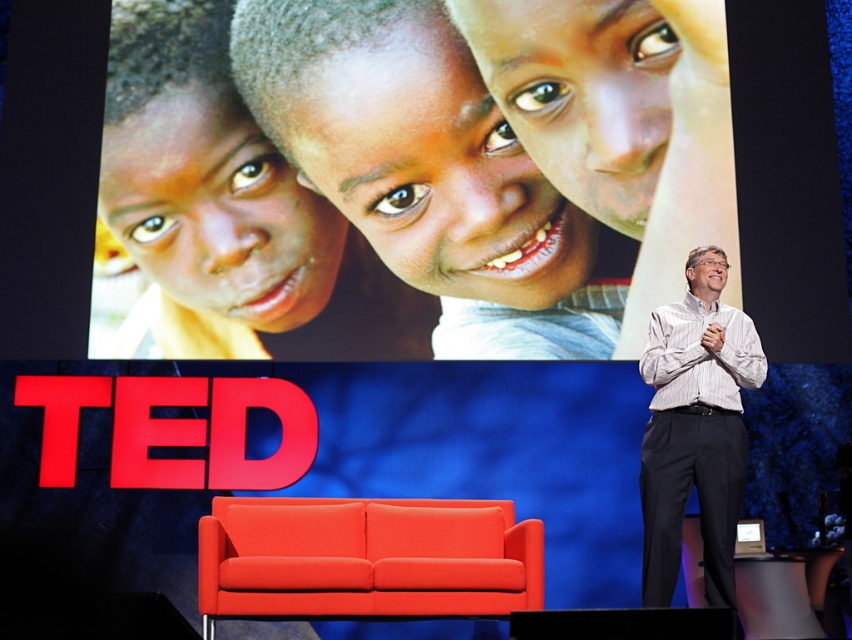
Question: Is matte orange couch at lower center wider than white striped shirt at right?

Choices:
 (A) yes
 (B) no

Answer: (A)

Question: Does matte orange couch at lower center have a larger size compared to white striped shirt at right?

Choices:
 (A) no
 (B) yes

Answer: (B)

Question: Where is matte orange couch at lower center located in relation to white striped shirt at right in the image?

Choices:
 (A) below
 (B) above

Answer: (A)

Question: Which object appears farthest from the camera in this image?

Choices:
 (A) white striped shirt at right
 (B) matte orange couch at lower center

Answer: (B)

Question: Which object appears farthest from the camera in this image?

Choices:
 (A) white striped shirt at right
 (B) matte orange couch at lower center

Answer: (B)

Question: Which point is closer to the camera taking this photo?

Choices:
 (A) click(x=401, y=545)
 (B) click(x=728, y=506)

Answer: (B)